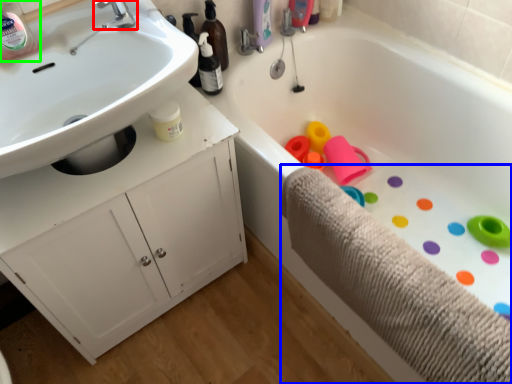
Question: Based on their relative distances, which object is nearer to tap (highlighted by a red box)? Choose from bath towel (highlighted by a blue box) and bottle (highlighted by a green box).

Choices:
 (A) bath towel
 (B) bottle

Answer: (B)